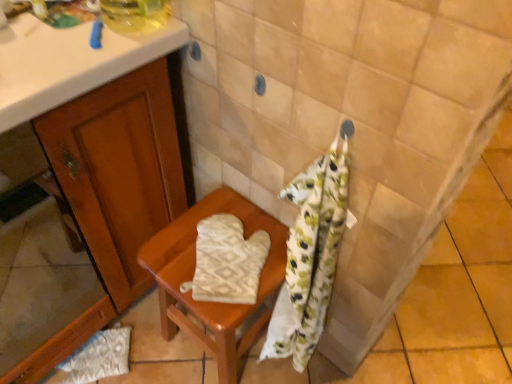
This screenshot has height=384, width=512. What are the coordinates of `blank space to the left of beige textured oven mitt at center` in the screenshot? It's located at (175, 257).